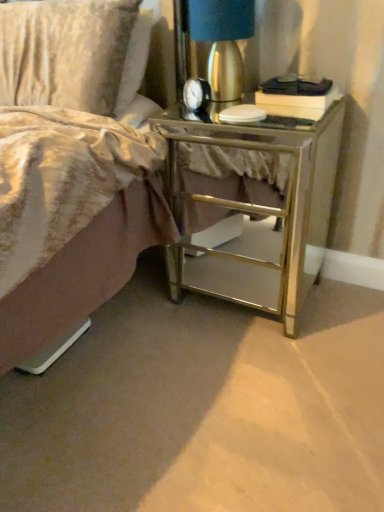
Where is `velvety gold pillow at upper left`? velvety gold pillow at upper left is located at coordinates (65, 52).

What do you see at coordinates (260, 214) in the screenshot?
I see `mirrored glass nightstand at lower right` at bounding box center [260, 214].

Where is `velvety gold pillow at upper left`? velvety gold pillow at upper left is located at coordinates (65, 52).

Considering the positions of objects mirrored glass nightstand at lower right and velvety gold pillow at upper left in the image provided, who is more to the right, mirrored glass nightstand at lower right or velvety gold pillow at upper left?

mirrored glass nightstand at lower right.

How many degrees apart are the facing directions of mirrored glass nightstand at lower right and velvety gold pillow at upper left?

0.00054 degrees.

Could you tell me if mirrored glass nightstand at lower right is turned towards velvety gold pillow at upper left?

No, mirrored glass nightstand at lower right is not aimed at velvety gold pillow at upper left.

Measure the distance between mirrored glass nightstand at lower right and velvety gold pillow at upper left.

The distance of mirrored glass nightstand at lower right from velvety gold pillow at upper left is 20.02 inches.

Locate an element on the screen. This screenshot has width=384, height=512. bedside lamp above the mirrored glass nightstand at lower right (from a real-world perspective) is located at coordinates (222, 42).

From the picture: How different are the orientations of metallic gold lamp at upper right and mirrored glass nightstand at lower right in degrees?

The angular difference between metallic gold lamp at upper right and mirrored glass nightstand at lower right is 0.00109 degrees.

In terms of width, does metallic gold lamp at upper right look wider or thinner when compared to mirrored glass nightstand at lower right?

metallic gold lamp at upper right is thinner than mirrored glass nightstand at lower right.

Is metallic gold lamp at upper right next to mirrored glass nightstand at lower right and touching it?

metallic gold lamp at upper right and mirrored glass nightstand at lower right are clearly separated.

From the image's perspective, is mirrored glass nightstand at lower right on metallic gold lamp at upper right?

Incorrect, from the image's perspective, mirrored glass nightstand at lower right is lower than metallic gold lamp at upper right.

Between mirrored glass nightstand at lower right and metallic gold lamp at upper right, which one has less height?

metallic gold lamp at upper right.

Which object is more forward, mirrored glass nightstand at lower right or metallic gold lamp at upper right?

mirrored glass nightstand at lower right is closer to the camera.

Which is nearer, (x=12, y=32) or (x=202, y=194)?

Point (x=12, y=32).

Visually, is velvety gold pillow at upper left positioned to the left or to the right of mirrored glass nightstand at lower right?

Based on their positions, velvety gold pillow at upper left is located to the left of mirrored glass nightstand at lower right.

Considering the sizes of objects metallic gold lamp at upper right and velvety gold pillow at upper left in the image provided, who is bigger, metallic gold lamp at upper right or velvety gold pillow at upper left?

Bigger between the two is velvety gold pillow at upper left.

The width and height of the screenshot is (384, 512). I want to click on bedside lamp that is below the velvety gold pillow at upper left (from the image's perspective), so click(222, 42).

Between metallic gold lamp at upper right and velvety gold pillow at upper left, which one has more height?

Standing taller between the two is velvety gold pillow at upper left.

Looking at this image, which object is thinner, metallic gold lamp at upper right or velvety gold pillow at upper left?

metallic gold lamp at upper right.

Between velvety gold pillow at upper left and metallic gold lamp at upper right, which one has more height?

Standing taller between the two is velvety gold pillow at upper left.

From the image's perspective, between velvety gold pillow at upper left and metallic gold lamp at upper right, which one is located above?

velvety gold pillow at upper left is shown above in the image.

Considering the points (75, 82) and (195, 60), which point is behind, point (75, 82) or point (195, 60)?

The point (75, 82) is behind.

In the image, is velvety gold pillow at upper left on the left side or the right side of metallic gold lamp at upper right?

In the image, velvety gold pillow at upper left appears on the left side of metallic gold lamp at upper right.

The image size is (384, 512). There is a mirrored glass nightstand at lower right. Identify the location of pillow above it (from a real-world perspective). (65, 52).

Identify the location of nightstand on the right of metallic gold lamp at upper right. (260, 214).

Estimate the real-world distances between objects in this image. Which object is closer to metallic gold lamp at upper right, velvety gold pillow at upper left or mirrored glass nightstand at lower right?

velvety gold pillow at upper left is positioned closer to the anchor metallic gold lamp at upper right.

From the image, which object appears to be nearer to velvety gold pillow at upper left, mirrored glass nightstand at lower right or metallic gold lamp at upper right?

Among the two, metallic gold lamp at upper right is located nearer to velvety gold pillow at upper left.

When comparing their distances from mirrored glass nightstand at lower right, does velvety gold pillow at upper left or metallic gold lamp at upper right seem closer?

metallic gold lamp at upper right.

Based on their spatial positions, is metallic gold lamp at upper right or mirrored glass nightstand at lower right closer to velvety gold pillow at upper left?

metallic gold lamp at upper right lies closer to velvety gold pillow at upper left than the other object.

Considering their positions, is metallic gold lamp at upper right positioned further to mirrored glass nightstand at lower right than velvety gold pillow at upper left?

velvety gold pillow at upper left.

Which object lies nearer to the anchor point metallic gold lamp at upper right, mirrored glass nightstand at lower right or velvety gold pillow at upper left?

velvety gold pillow at upper left.

Identify the location of bedside lamp between velvety gold pillow at upper left and mirrored glass nightstand at lower right. (222, 42).